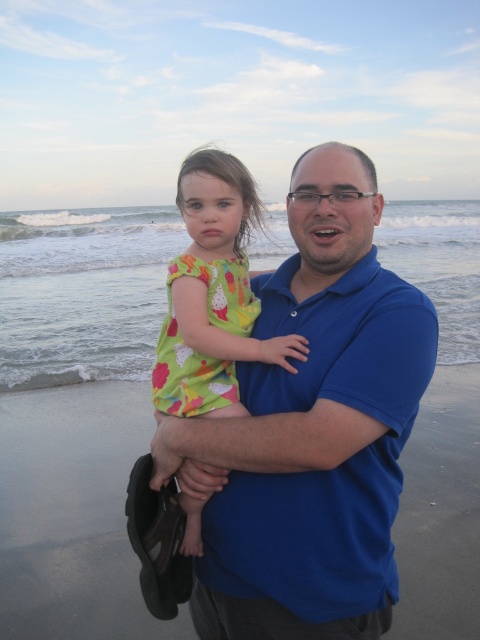
From the picture: Is blue cotton shirt at center thinner than smooth sand at center?

Correct, blue cotton shirt at center's width is less than smooth sand at center's.

What do you see at coordinates (311, 429) in the screenshot? The width and height of the screenshot is (480, 640). I see `blue cotton shirt at center` at bounding box center [311, 429].

The height and width of the screenshot is (640, 480). I want to click on blue cotton shirt at center, so click(311, 429).

Does smooth sand at center appear on the left side of printed cotton dress at center?

Yes, smooth sand at center is to the left of printed cotton dress at center.

Does smooth sand at center lie behind printed cotton dress at center?

Yes, it is behind printed cotton dress at center.

Is point (72, 426) in front of point (276, 349)?

No, it is not.

Where is `smooth sand at center`? This screenshot has height=640, width=480. smooth sand at center is located at coordinates (72, 515).

Is blue cotton shirt at center closer to the viewer compared to printed cotton dress at center?

Yes, blue cotton shirt at center is in front of printed cotton dress at center.

Between point (348, 525) and point (167, 410), which one is positioned in front?

Point (348, 525) is in front.

The image size is (480, 640). Identify the location of blue cotton shirt at center. (311, 429).